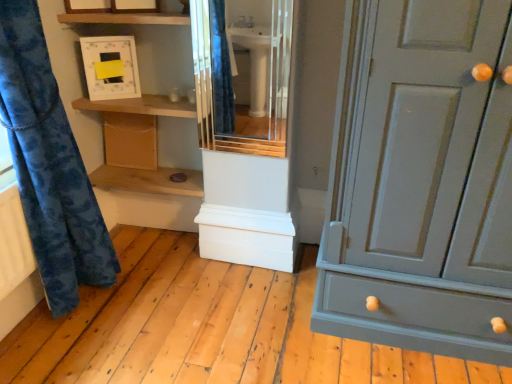
Measure the distance between matte gray cabinet at right and camera.

matte gray cabinet at right and camera are 3.65 feet apart from each other.

What do you see at coordinates (110, 67) in the screenshot? This screenshot has height=384, width=512. I see `matte white medicine cabinet at upper center` at bounding box center [110, 67].

In order to click on wooden cabinet at lower left in this screenshot , I will do `click(130, 140)`.

Locate an element on the screen. wooden shelf at center, acting as the first shelf starting from the bottom is located at coordinates click(148, 180).

This screenshot has height=384, width=512. What are the coordinates of `wooden shelf at upper center, the 2th shelf ordered from the bottom` in the screenshot? It's located at (141, 106).

From the image's perspective, is matte white cabinet at center located above or below blue fabric curtain at left?

Based on their image positions, matte white cabinet at center is located above blue fabric curtain at left.

How many degrees apart are the facing directions of matte white cabinet at center and blue fabric curtain at left?

The angle between the facing direction of matte white cabinet at center and the facing direction of blue fabric curtain at left is 91.2 degrees.

Would you say matte white cabinet at center is a long distance from blue fabric curtain at left?

That's right, there is a large distance between matte white cabinet at center and blue fabric curtain at left.

Is blue fabric curtain at left located within matte white cabinet at center?

No, blue fabric curtain at left is not a part of matte white cabinet at center.

From the image's perspective, which one is positioned higher, wooden shelf at center, acting as the first shelf starting from the bottom, or wooden cabinet at lower left?

wooden cabinet at lower left, from the image's perspective.

Considering the relative positions of wooden shelf at center, acting as the first shelf starting from the bottom, and wooden cabinet at lower left in the image provided, is wooden shelf at center, acting as the first shelf starting from the bottom, in front of wooden cabinet at lower left?

Yes.

How many degrees apart are the facing directions of wooden shelf at center, the second shelf from the top, and wooden cabinet at lower left?

0.847 degrees.

You are a GUI agent. You are given a task and a screenshot of the screen. Output one action in this format:
    pyautogui.click(x=<x>, y=<y>)
    Task: Click on the cabinetry behind the wooden shelf at center, the second shelf from the top
    The width and height of the screenshot is (512, 384).
    Given the screenshot: What is the action you would take?
    pyautogui.click(x=130, y=140)

Which object is closer to the camera, matte white medicine cabinet at upper center or matte gray cabinet at right?

matte gray cabinet at right is more forward.

Considering the points (112, 72) and (509, 17), which point is behind, point (112, 72) or point (509, 17)?

The point (112, 72) is behind.

From a real-world perspective, is matte white medicine cabinet at upper center beneath matte gray cabinet at right?

No, from a real-world perspective, matte white medicine cabinet at upper center is not beneath matte gray cabinet at right.

Considering the sizes of matte white medicine cabinet at upper center and matte gray cabinet at right in the image, is matte white medicine cabinet at upper center wider or thinner than matte gray cabinet at right?

Considering their sizes, matte white medicine cabinet at upper center looks slimmer than matte gray cabinet at right.

Between wooden shelf at center, the second shelf from the top, and matte white medicine cabinet at upper center, which one is positioned in front?

matte white medicine cabinet at upper center.

In terms of size, does wooden shelf at center, the second shelf from the top, appear bigger or smaller than matte white medicine cabinet at upper center?

wooden shelf at center, the second shelf from the top, is bigger than matte white medicine cabinet at upper center.

Is wooden shelf at center, acting as the first shelf starting from the bottom, not close to matte white medicine cabinet at upper center?

wooden shelf at center, acting as the first shelf starting from the bottom, is near matte white medicine cabinet at upper center, not far away.

Is point (103, 177) closer or farther from the camera than point (103, 47)?

Point (103, 177).

The image size is (512, 384). Find the location of `the 2nd shelf below the matte white medicine cabinet at upper center (from the image's perspective)`. the 2nd shelf below the matte white medicine cabinet at upper center (from the image's perspective) is located at coordinates (148, 180).

Is matte white medicine cabinet at upper center smaller than wooden shelf at center, acting as the first shelf starting from the bottom?

Yes, matte white medicine cabinet at upper center is smaller than wooden shelf at center, acting as the first shelf starting from the bottom.

How many degrees apart are the facing directions of matte white medicine cabinet at upper center and wooden shelf at center, acting as the first shelf starting from the bottom?

The facing directions of matte white medicine cabinet at upper center and wooden shelf at center, acting as the first shelf starting from the bottom, are 29.9 degrees apart.

Looking at this image, from a real-world perspective, is matte white medicine cabinet at upper center above or below wooden shelf at center, acting as the first shelf starting from the bottom?

Clearly, from a real-world perspective, matte white medicine cabinet at upper center is above wooden shelf at center, acting as the first shelf starting from the bottom.

Where is `cabinetry below the matte gray cabinet at right (from a real-world perspective)`? The height and width of the screenshot is (384, 512). cabinetry below the matte gray cabinet at right (from a real-world perspective) is located at coordinates (130, 140).

Is matte gray cabinet at right at the back of wooden cabinet at lower left?

No, wooden cabinet at lower left is not facing away from matte gray cabinet at right.

From the image's perspective, which is above, wooden cabinet at lower left or matte gray cabinet at right?

wooden cabinet at lower left.

Considering the positions of objects matte white medicine cabinet at upper center and matte white cabinet at center in the image provided, who is more to the left, matte white medicine cabinet at upper center or matte white cabinet at center?

From the viewer's perspective, matte white medicine cabinet at upper center appears more on the left side.

Is matte white medicine cabinet at upper center aimed at matte white cabinet at center?

No, matte white medicine cabinet at upper center is not facing towards matte white cabinet at center.

Is matte white medicine cabinet at upper center smaller than matte white cabinet at center?

Correct, matte white medicine cabinet at upper center occupies less space than matte white cabinet at center.

Looking at their sizes, would you say matte white medicine cabinet at upper center is wider or thinner than matte white cabinet at center?

Clearly, matte white medicine cabinet at upper center has more width compared to matte white cabinet at center.

At what (x,y) coordinates should I click in order to perform the action: click on curtain located underneath the matte white cabinet at center (from a real-world perspective). Please return your answer as a coordinate pair (x, y). Looking at the image, I should click on 49,166.

The height and width of the screenshot is (384, 512). I want to click on the 1st shelf counting from the right of the wooden cabinet at lower left, so click(x=148, y=180).

Considering their positions, is matte gray cabinet at right positioned closer to wooden shelf at center, the second shelf from the top, than wooden shelf at upper center, the 2th shelf ordered from the bottom?

wooden shelf at upper center, the 2th shelf ordered from the bottom, lies closer to wooden shelf at center, the second shelf from the top, than the other object.

Estimate the real-world distances between objects in this image. Which object is further from matte white cabinet at center, matte gray cabinet at right or matte white medicine cabinet at upper center?

matte gray cabinet at right is positioned further to the anchor matte white cabinet at center.

From the picture: From the image, which object appears to be nearer to blue fabric curtain at left, matte white cabinet at center or wooden cabinet at lower left?

wooden cabinet at lower left lies closer to blue fabric curtain at left than the other object.

Estimate the real-world distances between objects in this image. Which object is closer to matte gray cabinet at right, wooden cabinet at lower left or blue fabric curtain at left?

Based on the image, blue fabric curtain at left appears to be nearer to matte gray cabinet at right.

Estimate the real-world distances between objects in this image. Which object is closer to wooden shelf at center, the second shelf from the top, matte white cabinet at center or blue fabric curtain at left?

blue fabric curtain at left lies closer to wooden shelf at center, the second shelf from the top, than the other object.

When comparing their distances from matte gray cabinet at right, does blue fabric curtain at left or matte white cabinet at center seem further?

The object further to matte gray cabinet at right is matte white cabinet at center.

Which object lies nearer to the anchor point matte gray cabinet at right, wooden shelf at upper center, which is the first shelf in top-to-bottom order, or wooden shelf at center, the second shelf from the top?

Among the two, wooden shelf at upper center, which is the first shelf in top-to-bottom order, is located nearer to matte gray cabinet at right.

Based on their spatial positions, is matte white medicine cabinet at upper center or wooden shelf at upper center, the 2th shelf ordered from the bottom, further from wooden shelf at center, the second shelf from the top?

matte white medicine cabinet at upper center lies further to wooden shelf at center, the second shelf from the top, than the other object.

Find the location of a particular element. The width and height of the screenshot is (512, 384). shelf between blue fabric curtain at left and matte white medicine cabinet at upper center in the front-back direction is located at coordinates (141, 106).

This screenshot has height=384, width=512. Find the location of `cabinet between blue fabric curtain at left and matte gray cabinet at right`. cabinet between blue fabric curtain at left and matte gray cabinet at right is located at coordinates (250, 75).

Where is `cabinet between blue fabric curtain at left and wooden cabinet at lower left along the z-axis`? The image size is (512, 384). cabinet between blue fabric curtain at left and wooden cabinet at lower left along the z-axis is located at coordinates [x=250, y=75].

You are a GUI agent. You are given a task and a screenshot of the screen. Output one action in this format:
    pyautogui.click(x=<x>, y=<y>)
    Task: Click on the cabinetry between matte white medicine cabinet at upper center and wooden shelf at center, acting as the first shelf starting from the bottom, from top to bottom
    The width and height of the screenshot is (512, 384).
    Given the screenshot: What is the action you would take?
    pyautogui.click(x=130, y=140)